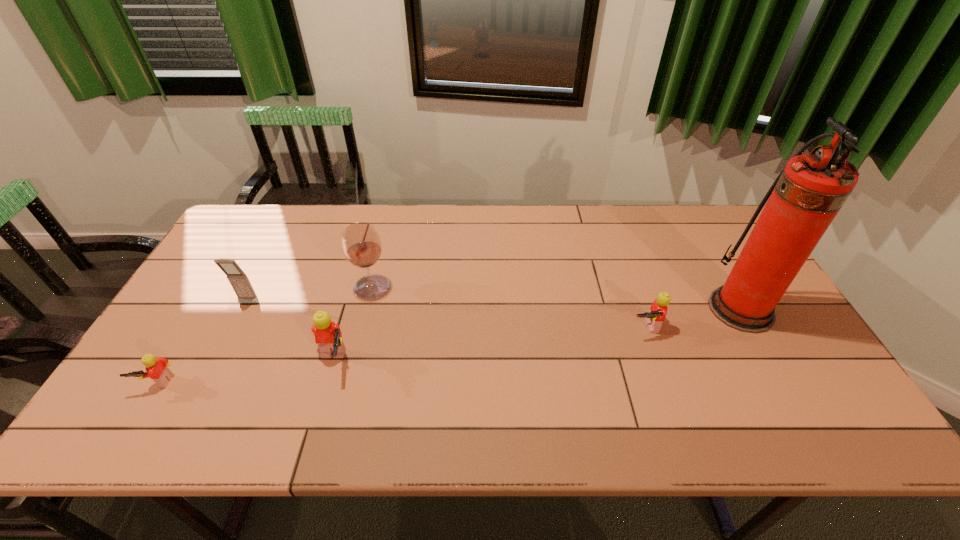
At what (x,y) coordinates should I click in order to perform the action: click on the shortest object. Please return your answer as a coordinate pair (x, y). This screenshot has height=540, width=960. Looking at the image, I should click on (157, 370).

Locate an element on the screen. This screenshot has height=540, width=960. the shortest Lego is located at coordinates (x=157, y=370).

At what (x,y) coordinates should I click in order to perform the action: click on the third shortest object. Please return your answer as a coordinate pair (x, y). The image size is (960, 540). Looking at the image, I should click on (328, 336).

Locate an element on the screen. This screenshot has width=960, height=540. the second Lego from left to right is located at coordinates (328, 336).

Identify the location of the fifth object from left to right. (658, 311).

In order to click on the farthest Lego in this screenshot , I will do `click(658, 311)`.

The image size is (960, 540). I want to click on the rightmost object, so click(806, 196).

At what (x,y) coordinates should I click in order to perform the action: click on fire extinguisher. Please return your answer as a coordinate pair (x, y). The image size is (960, 540). Looking at the image, I should click on (806, 196).

This screenshot has height=540, width=960. In order to click on cellular telephone in this screenshot , I will do `click(239, 281)`.

You are a GUI agent. You are given a task and a screenshot of the screen. Output one action in this format:
    pyautogui.click(x=<x>, y=<y>)
    Task: Click on the wineglass
    This screenshot has height=540, width=960.
    Given the screenshot: What is the action you would take?
    pyautogui.click(x=361, y=243)